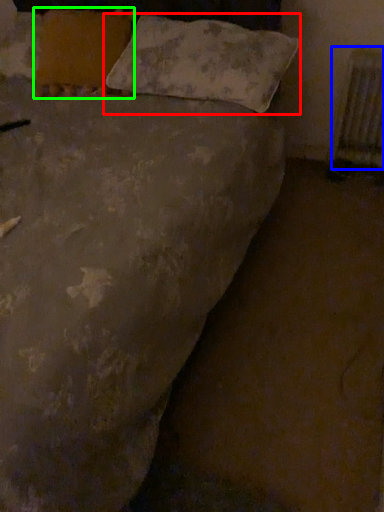
Question: Which object is positioned farthest from pillow (highlighted by a red box)? Select from radiator (highlighted by a blue box) and pillow (highlighted by a green box).

Choices:
 (A) radiator
 (B) pillow

Answer: (A)